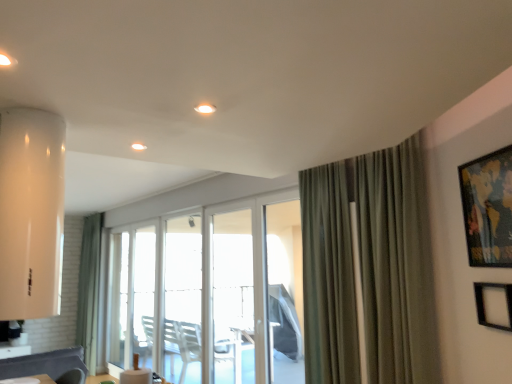
Question: Is clear glass screen door at center, which is the second screen door in right-to-left order, in front of or behind transparent plastic screen door at center, arranged as the second screen door when viewed from the left, in the image?

Choices:
 (A) front
 (B) behind

Answer: (B)

Question: Visually, is clear glass screen door at center, which is the second screen door in right-to-left order, positioned to the left or to the right of transparent plastic screen door at center, arranged as the second screen door when viewed from the left?

Choices:
 (A) left
 (B) right

Answer: (A)

Question: Which object is positioned farthest from the wooden framed map at upper right, the first picture frame from the top?

Choices:
 (A) green fabric curtain at left, the first curtain viewed from the left
 (B) transparent plastic screen door at center, arranged as the second screen door when viewed from the left
 (C) black matte picture frame at upper right, arranged as the second picture frame when viewed from the top
 (D) green textured curtain at right, which ranks as the 2th curtain in back-to-front order
 (E) transparent glass window at center

Answer: (A)

Question: Considering the real-world distances, which object is farthest from the transparent glass window at center?

Choices:
 (A) transparent plastic screen door at center, arranged as the first screen door when viewed from the right
 (B) black matte picture frame at upper right, placed as the 1th picture frame when sorted from bottom to top
 (C) clear glass door at center
 (D) white glossy light at upper center, the first light from the back
 (E) clear glass screen door at center, which is the second screen door in right-to-left order

Answer: (B)